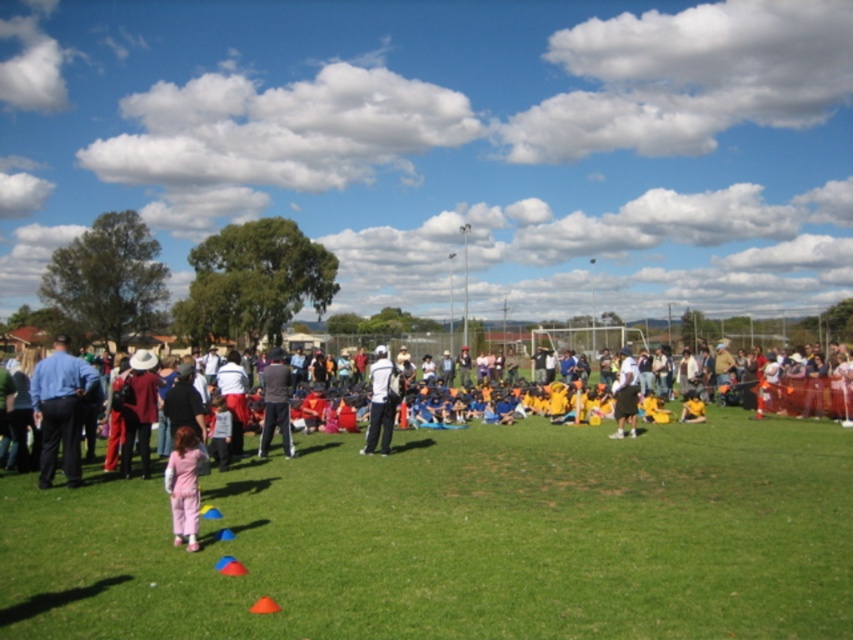
Does white matte shirt at center lie behind white cotton shirt at center?

That is False.

Who is lower down, white matte shirt at center or white cotton shirt at center?

Positioned lower is white cotton shirt at center.

Does point (376, 436) come behind point (625, 358)?

That is False.

You are a GUI agent. You are given a task and a screenshot of the screen. Output one action in this format:
    pyautogui.click(x=<x>, y=<y>)
    Task: Click on the white matte shirt at center
    The height and width of the screenshot is (640, 853).
    Given the screenshot: What is the action you would take?
    pyautogui.click(x=381, y=401)

Can you confirm if dark gray pants at center is shorter than white cotton shirt at center?

No, dark gray pants at center is not shorter than white cotton shirt at center.

You are a GUI agent. You are given a task and a screenshot of the screen. Output one action in this format:
    pyautogui.click(x=<x>, y=<y>)
    Task: Click on the dark gray pants at center
    Image resolution: width=853 pixels, height=640 pixels.
    Given the screenshot: What is the action you would take?
    pyautogui.click(x=276, y=403)

Can you confirm if pink fabric pants at lower left is positioned to the right of white matte shirt at center?

Indeed, pink fabric pants at lower left is positioned on the right side of white matte shirt at center.

Describe the element at coordinates (502, 404) in the screenshot. I see `pink fabric pants at lower left` at that location.

At what (x,y) coordinates should I click in order to perform the action: click on pink fabric pants at lower left. Please return your answer as a coordinate pair (x, y). Looking at the image, I should click on (502, 404).

The width and height of the screenshot is (853, 640). Find the location of `pink fabric pants at lower left`. pink fabric pants at lower left is located at coordinates (502, 404).